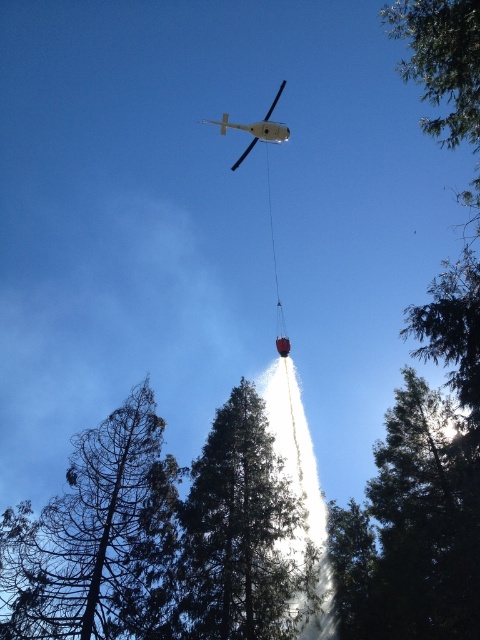
You are a pilot flying a helicopter and need to determine the order of two points in your flight path. The first point is point [153,566] and the second is point [255,122]. Based on your current position, which point should you reach first?

Point [153,566] is in front of point [255,122], so you should reach point [153,566] first.

You are a pilot flying a helicopter and need to navigate between the dark brown bark tree at lower left and the green textured tree at center. Based on their positions, which tree should you avoid flying under to stay above both?

The dark brown bark tree at lower left is located below the green textured tree at center. To stay above both trees, you should avoid flying under the green textured tree at center since it is higher up, and the dark brown bark tree is already positioned lower.